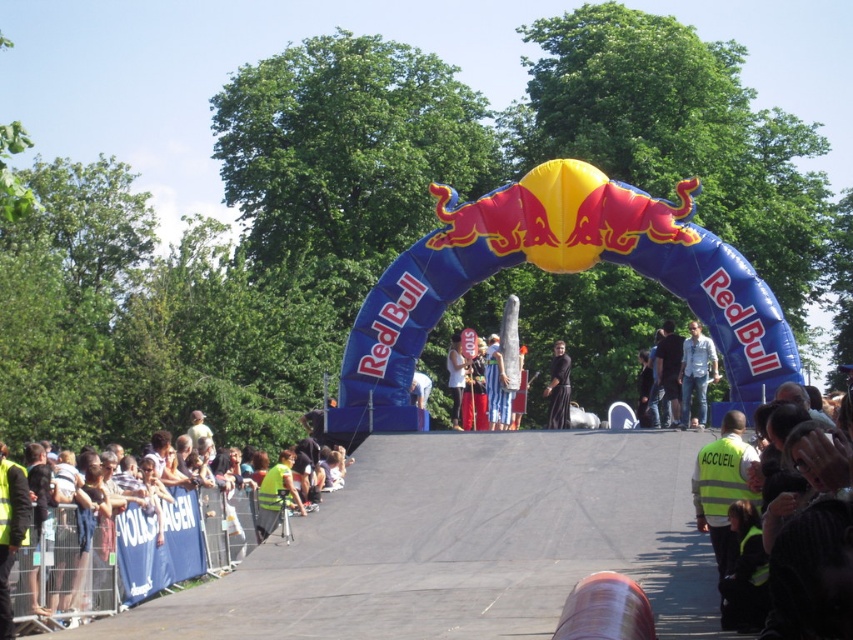
Question: Which of the following is the farthest from the observer?

Choices:
 (A) (563, 394)
 (B) (241, 545)

Answer: (A)

Question: Does yellow reflective vests at lower left have a larger size compared to black cloth at center?

Choices:
 (A) yes
 (B) no

Answer: (A)

Question: Is the position of yellow reflective vests at lower left less distant than that of black cloth at center?

Choices:
 (A) yes
 (B) no

Answer: (A)

Question: Which object is closer to the camera taking this photo?

Choices:
 (A) yellow reflective vests at lower left
 (B) black cloth at center

Answer: (A)

Question: Does yellow reflective vests at lower left lie behind black cloth at center?

Choices:
 (A) yes
 (B) no

Answer: (B)